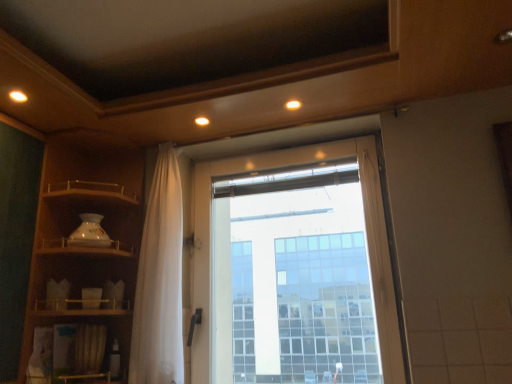
Question: From the image's perspective, is matte wood shelf at left positioned above or below transparent glass window at center?

Choices:
 (A) above
 (B) below

Answer: (A)

Question: Is matte wood shelf at left bigger or smaller than transparent glass window at center?

Choices:
 (A) small
 (B) big

Answer: (B)

Question: Which object is positioned closest to the matte wood shelf at left?

Choices:
 (A) transparent glass window at center
 (B) white sheer curtain at center

Answer: (B)

Question: Estimate the real-world distances between objects in this image. Which object is closer to the matte wood shelf at left?

Choices:
 (A) white sheer curtain at center
 (B) transparent glass window at center

Answer: (A)